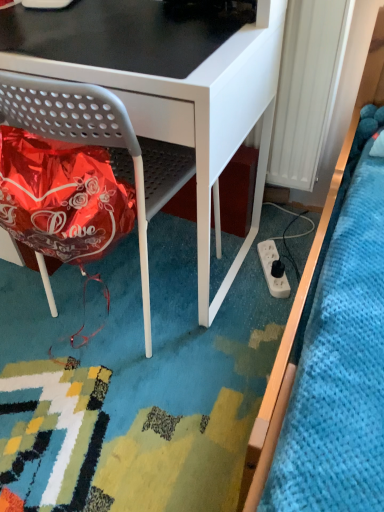
Describe the element at coordinates (101, 144) in the screenshot. The height and width of the screenshot is (512, 384). I see `matte gray chair at lower left` at that location.

The image size is (384, 512). Identify the location of matte gray chair at lower left. (101, 144).

In order to click on white plastic power plugs and sockets at lower right in this screenshot , I will do `click(270, 269)`.

Locate an element on the screen. The image size is (384, 512). radiator in front of the white plastic power plugs and sockets at lower right is located at coordinates (307, 89).

Between white plastic power plugs and sockets at lower right and white plastic radiator at right, which one has smaller width?

white plastic radiator at right is thinner.

Does white plastic power plugs and sockets at lower right contain white plastic radiator at right?

No.

Would you say white plastic power plugs and sockets at lower right is to the left or to the right of white plastic radiator at right in the picture?

In the image, white plastic power plugs and sockets at lower right appears on the left side of white plastic radiator at right.

Considering the sizes of objects white plastic radiator at right and matte gray chair at lower left in the image provided, who is taller, white plastic radiator at right or matte gray chair at lower left?

matte gray chair at lower left.

Considering the relative sizes of white plastic radiator at right and matte gray chair at lower left in the image provided, is white plastic radiator at right wider than matte gray chair at lower left?

No.

Where is `radiator lying in front of the white plastic power plugs and sockets at lower right`? The image size is (384, 512). radiator lying in front of the white plastic power plugs and sockets at lower right is located at coordinates (307, 89).

Which of these two, white plastic radiator at right or white plastic power plugs and sockets at lower right, is wider?

Wider between the two is white plastic power plugs and sockets at lower right.

Is white plastic radiator at right in contact with white plastic power plugs and sockets at lower right?

No, white plastic radiator at right is not next to white plastic power plugs and sockets at lower right.

Does point (323, 135) come closer to viewer compared to point (283, 281)?

Yes.

Is point (286, 279) positioned before point (121, 129)?

No, it is not.

The height and width of the screenshot is (512, 384). I want to click on chair on the left of white plastic power plugs and sockets at lower right, so click(101, 144).

Looking at this image, based on their sizes in the image, would you say white plastic power plugs and sockets at lower right is bigger or smaller than matte gray chair at lower left?

Clearly, white plastic power plugs and sockets at lower right is smaller in size than matte gray chair at lower left.

Considering the relative sizes of white plastic power plugs and sockets at lower right and matte gray chair at lower left in the image provided, is white plastic power plugs and sockets at lower right shorter than matte gray chair at lower left?

Yes.

Which is farther, (173, 181) or (292, 182)?

Positioned behind is point (292, 182).

Are matte gray chair at lower left and white plastic radiator at right located far from each other?

matte gray chair at lower left is actually quite close to white plastic radiator at right.

Between matte gray chair at lower left and white plastic radiator at right, which one has larger width?

matte gray chair at lower left.

Can white plastic power plugs and sockets at lower right be found inside matte gray chair at lower left?

That's incorrect, white plastic power plugs and sockets at lower right is not inside matte gray chair at lower left.

Which is behind, point (162, 186) or point (276, 248)?

Point (276, 248)

How different are the orientations of matte gray chair at lower left and white plastic power plugs and sockets at lower right in degrees?

The angle between the facing direction of matte gray chair at lower left and the facing direction of white plastic power plugs and sockets at lower right is 152 degrees.

Is matte gray chair at lower left facing towards white plastic power plugs and sockets at lower right?

No, matte gray chair at lower left is not turned towards white plastic power plugs and sockets at lower right.

This screenshot has height=512, width=384. Find the location of `power plugs and sockets below the white plastic radiator at right (from the image's perspective)`. power plugs and sockets below the white plastic radiator at right (from the image's perspective) is located at coordinates tap(270, 269).

This screenshot has height=512, width=384. Find the location of `chair that appears below the white plastic radiator at right (from a real-world perspective)`. chair that appears below the white plastic radiator at right (from a real-world perspective) is located at coordinates (101, 144).

Considering their positions, is matte gray chair at lower left positioned closer to white plastic power plugs and sockets at lower right than white plastic radiator at right?

Based on the image, white plastic radiator at right appears to be nearer to white plastic power plugs and sockets at lower right.

Based on the photo, which object lies further to the anchor point white plastic power plugs and sockets at lower right, white plastic radiator at right or matte gray chair at lower left?

matte gray chair at lower left lies further to white plastic power plugs and sockets at lower right than the other object.

Considering their positions, is matte gray chair at lower left positioned further to white plastic radiator at right than white plastic power plugs and sockets at lower right?

matte gray chair at lower left.

Considering their positions, is white plastic power plugs and sockets at lower right positioned further to white plastic radiator at right than matte gray chair at lower left?

matte gray chair at lower left lies further to white plastic radiator at right than the other object.

When comparing their distances from matte gray chair at lower left, does white plastic power plugs and sockets at lower right or white plastic radiator at right seem closer?

white plastic radiator at right is closer to matte gray chair at lower left.

Estimate the real-world distances between objects in this image. Which object is further from matte gray chair at lower left, white plastic radiator at right or white plastic power plugs and sockets at lower right?

white plastic power plugs and sockets at lower right is positioned further to the anchor matte gray chair at lower left.

Where is `radiator located between matte gray chair at lower left and white plastic power plugs and sockets at lower right in the depth direction`? The height and width of the screenshot is (512, 384). radiator located between matte gray chair at lower left and white plastic power plugs and sockets at lower right in the depth direction is located at coordinates (307, 89).